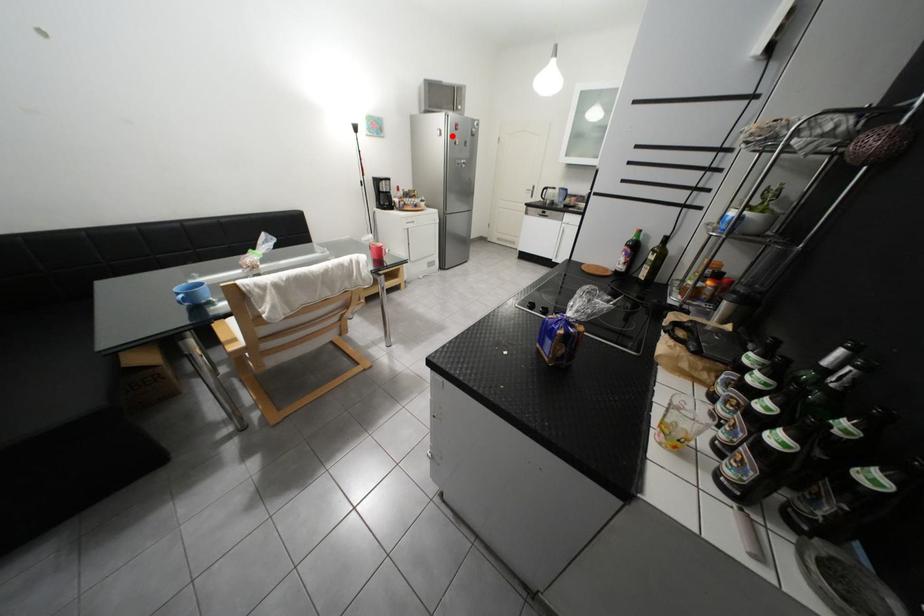
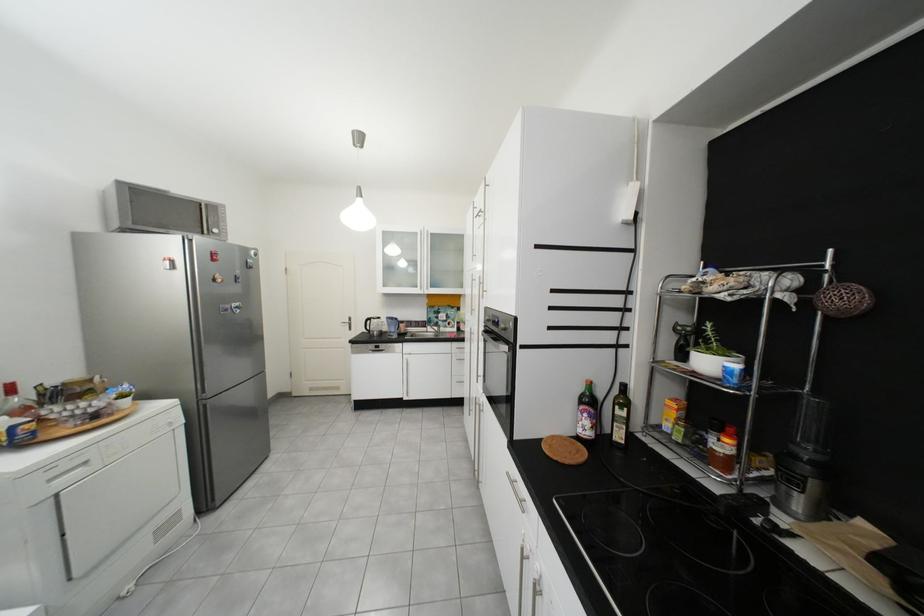
Question: I am providing you with two images of the same scene from different viewpoints. A red point is shown in image1. For the corresponding object point in image2, is it positioned nearer or farther from the camera?

Choices:
 (A) Nearer
 (B) Farther

Answer: (B)